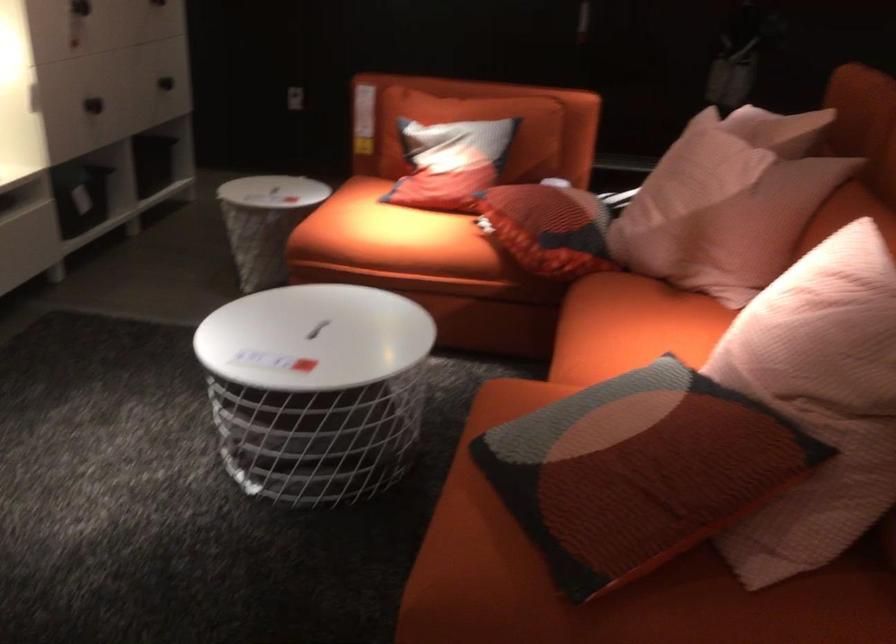
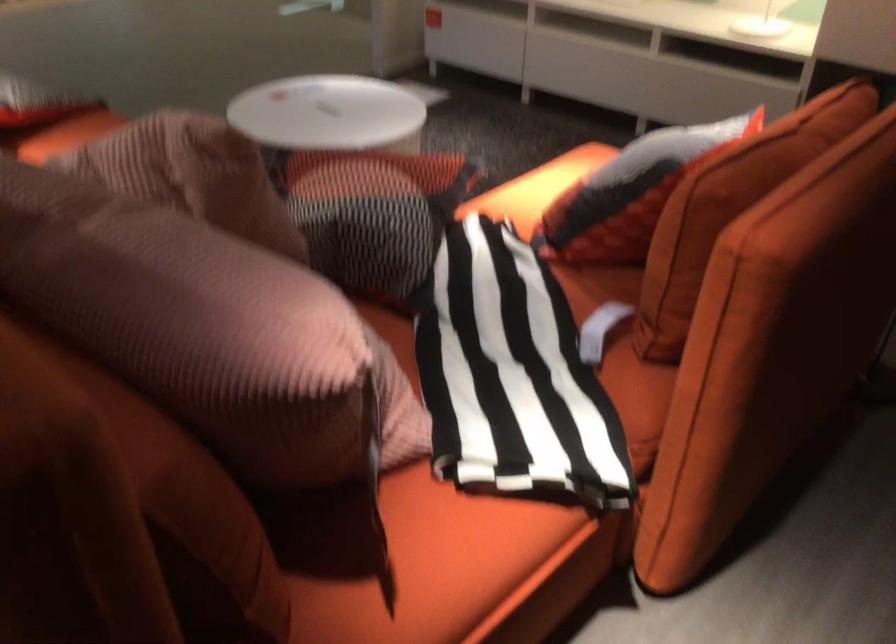
Find the pixel in the second image that matches (588,129) in the first image.

(771, 346)